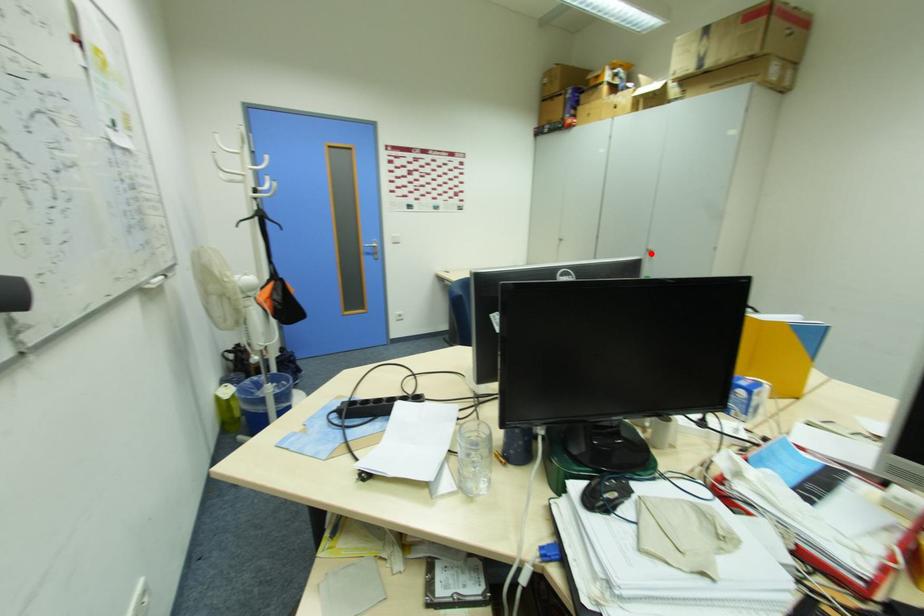
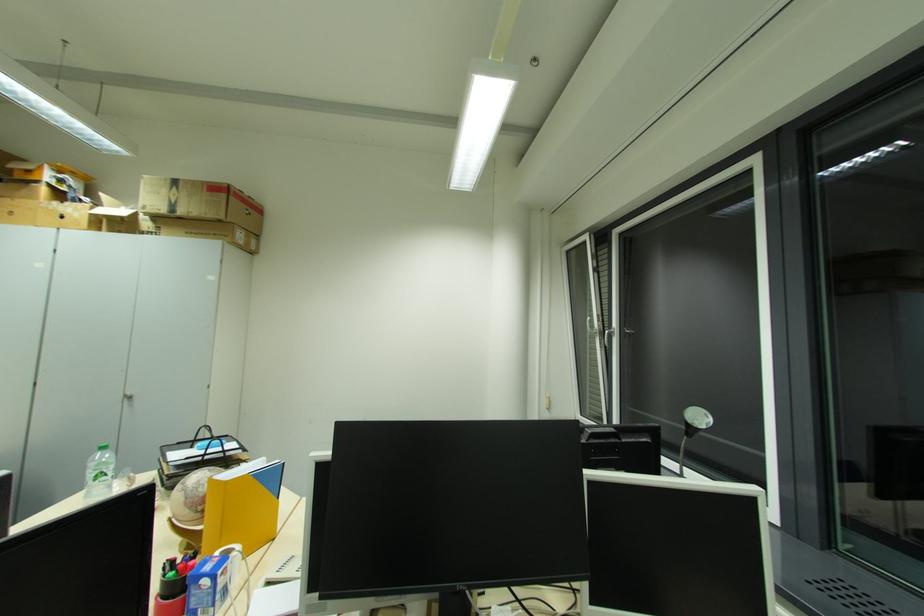
In the second image, find the point that corresponds to the highlighted location in the first image.

(128, 400)